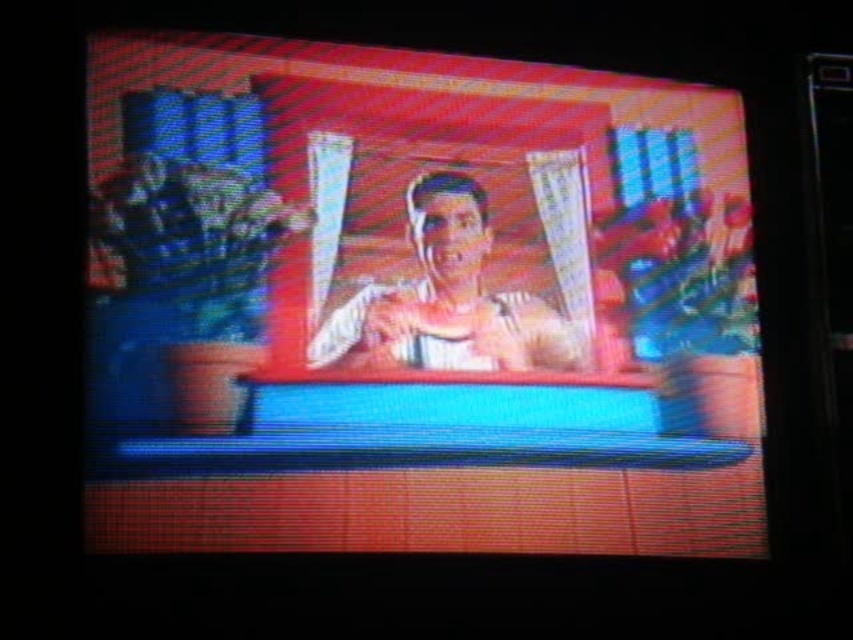
You are looking at the television screen and notice the matte plastic screen at center and the smooth beige shirt at center. Which object is positioned lower in the image?

The matte plastic screen at center is located below the smooth beige shirt at center, so it is positioned lower in the image.

From the picture: You are standing in front of a TV screen and want to take a photo of the matte plastic screen at center using a camera. The camera requires the subject to be at least 6 meters away for optimal focus. Can you take a clear photo from your current position?

The matte plastic screen at center and camera are 5.83 meters apart from each other, which is less than the required 6 meters for optimal focus. Therefore, you cannot take a clear photo from your current position.